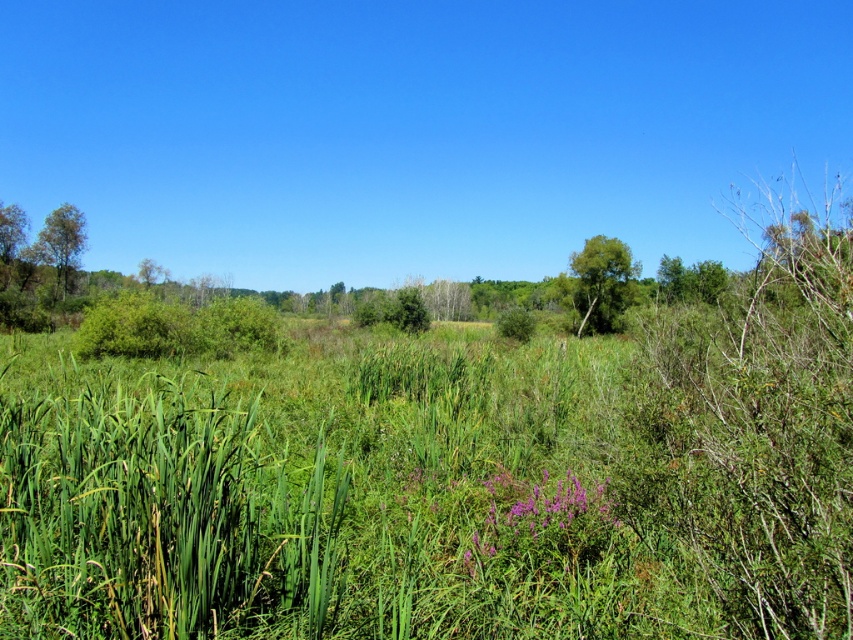
Can you confirm if green leafy tree at center is wider than green leafy tree at upper left?

Yes, green leafy tree at center is wider than green leafy tree at upper left.

Does green leafy tree at center have a greater height compared to green leafy tree at upper left?

Yes.

At what (x,y) coordinates should I click in order to perform the action: click on green leafy tree at center. Please return your answer as a coordinate pair (x, y). The height and width of the screenshot is (640, 853). Looking at the image, I should click on (601, 282).

The image size is (853, 640). I want to click on green leafy tree at center, so click(x=601, y=282).

Between green matte tree at left and green leafy tree at upper left, which one has more height?

green matte tree at left is taller.

Can you confirm if green matte tree at left is wider than green leafy tree at upper left?

Indeed, green matte tree at left has a greater width compared to green leafy tree at upper left.

Identify the location of green matte tree at left. (62, 243).

The width and height of the screenshot is (853, 640). Find the location of `green matte tree at left`. green matte tree at left is located at coordinates (62, 243).

Is green leafy tree at center bigger than green matte tree at left?

Indeed, green leafy tree at center has a larger size compared to green matte tree at left.

Is green leafy tree at center to the left of green matte tree at left from the viewer's perspective?

No, green leafy tree at center is not to the left of green matte tree at left.

The width and height of the screenshot is (853, 640). In order to click on green leafy tree at center in this screenshot , I will do click(601, 282).